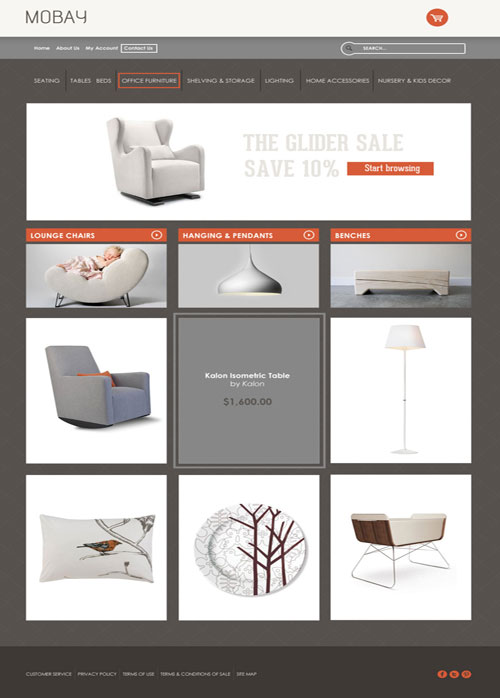
What are the coordinates of `decorative plate for sale` in the screenshot? It's located at (236, 551).